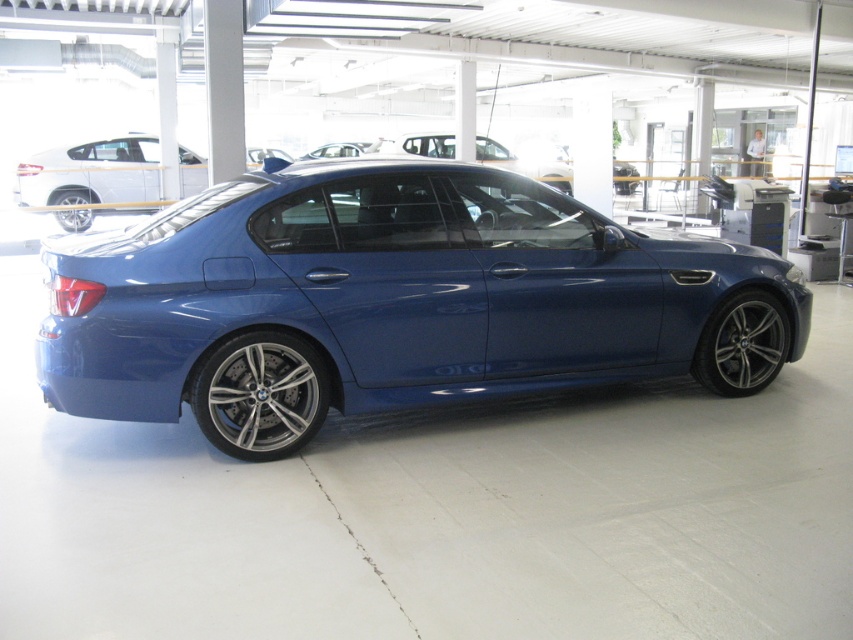
Question: Is glossy metallic car at center below polished aluminum wheel at lower center?

Choices:
 (A) no
 (B) yes

Answer: (A)

Question: Which object is closer to the camera taking this photo?

Choices:
 (A) polished silver wheel at lower right
 (B) glossy metallic car at center
 (C) polished aluminum wheel at lower center

Answer: (B)

Question: Is the position of glossy metallic car at center more distant than that of polished silver wheel at lower right?

Choices:
 (A) no
 (B) yes

Answer: (A)

Question: Which of the following is the farthest from the observer?

Choices:
 (A) (729, 332)
 (B) (61, 200)
 (C) (288, 428)
 (D) (374, 225)

Answer: (B)

Question: From the image, what is the correct spatial relationship of glossy metallic car at center in relation to polished silver wheel at lower right?

Choices:
 (A) left
 (B) right

Answer: (A)

Question: Which point is farther to the camera?

Choices:
 (A) (70, 220)
 (B) (267, 440)
 (C) (267, 356)

Answer: (A)